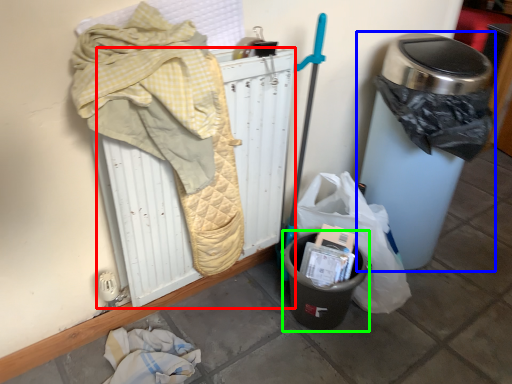
Question: Based on their relative distances, which object is farther from radiator (highlighted by a red box)? Choose from waste container (highlighted by a blue box) and recycling bin (highlighted by a green box).

Choices:
 (A) waste container
 (B) recycling bin

Answer: (A)